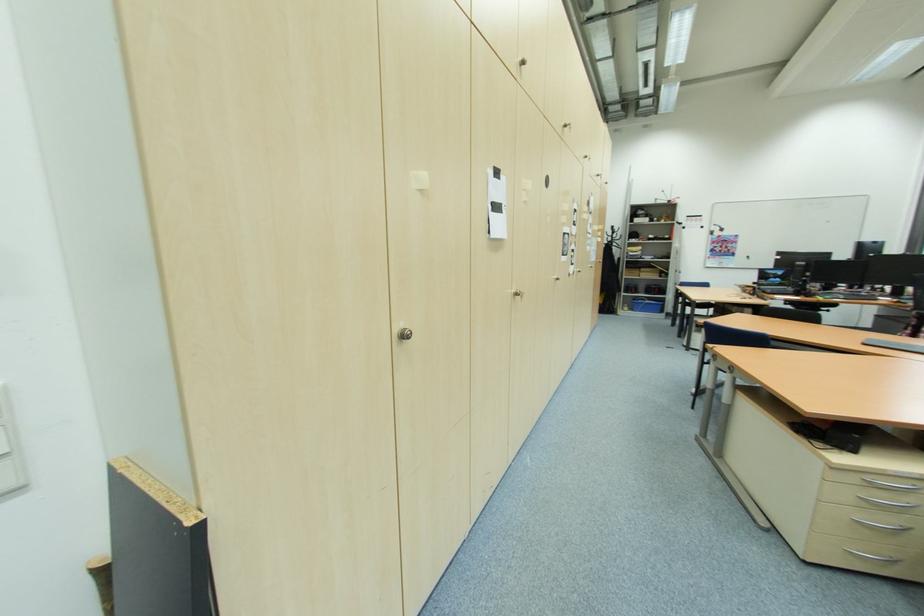
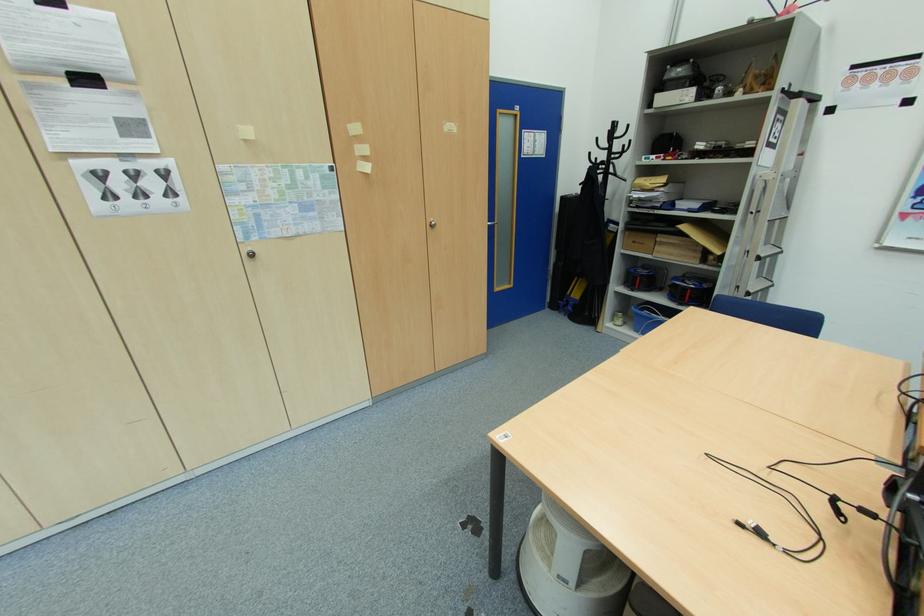
The point at (664, 286) is marked in the first image. Where is the corresponding point in the second image?

(709, 286)